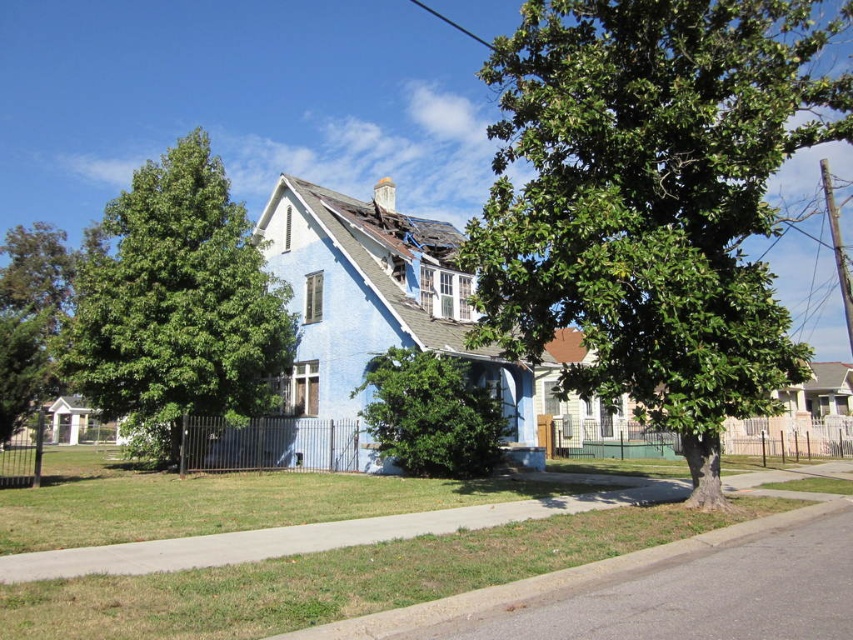
You are standing at the sidewalk in front of the house and want to walk towards the green leafy tree at left and the green leafy tree at lower left. Which tree should you walk towards if you want to reach the one that is positioned more to the left side of the property?

You should walk towards the green leafy tree at left because it is positioned more to the left compared to the green leafy tree at lower left.

You are standing at the entrance of the house and want to place a decorative pot exactly at the center of the property. The property is a rectangle with its corners at coordinates 0,0 to 1,1. According to the image, where is the green leafy bush at center located in relation to the property center?

The green leafy bush at center is located at point (431, 413), which is to the right of the property center at (426, 320).

You are a drone operator tasked with capturing aerial footage of the house. The green leafy tree at center is blocking the view. Where should you position the drone to avoid the tree and still capture the house?

The green leafy tree at center is located at point (651,202). To avoid the tree and capture the house, position the drone either to the left or right of the tree along the x or y axis, ensuring the house remains in frame.